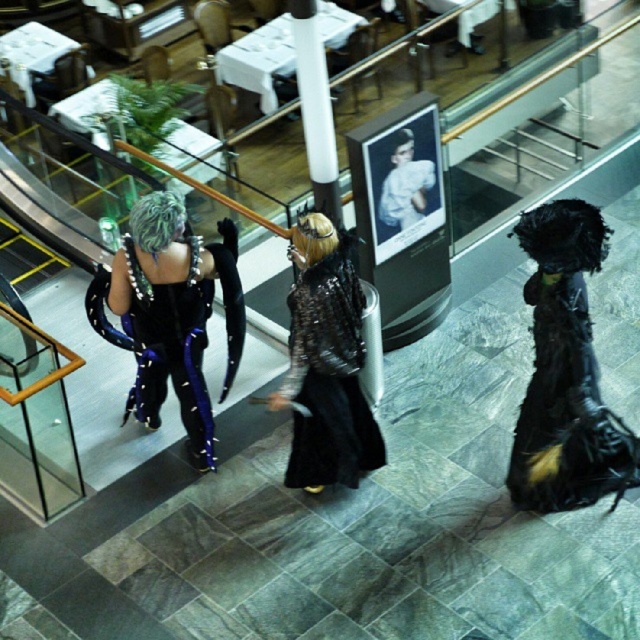
Question: Based on their relative distances, which object is nearer to the black leather boots at right?

Choices:
 (A) shiny silver armor at center
 (B) shiny black armor at left
 (C) shiny black wig at center
 (D) shiny silver wig at upper left

Answer: (A)

Question: Which object is positioned farthest from the black leather boots at right?

Choices:
 (A) shiny silver armor at center
 (B) shiny silver wig at upper left
 (C) shiny black armor at left
 (D) shiny black wig at center

Answer: (B)

Question: Can you confirm if black leather boots at right is thinner than shiny silver wig at upper left?

Choices:
 (A) no
 (B) yes

Answer: (A)

Question: Does black leather boots at right have a smaller size compared to shiny silver armor at center?

Choices:
 (A) no
 (B) yes

Answer: (B)

Question: Which object is the closest to the shiny black armor at left?

Choices:
 (A) black leather boots at right
 (B) shiny silver armor at center
 (C) shiny black wig at center

Answer: (B)

Question: Where is shiny black armor at left located in relation to shiny black wig at center in the image?

Choices:
 (A) right
 (B) left

Answer: (B)